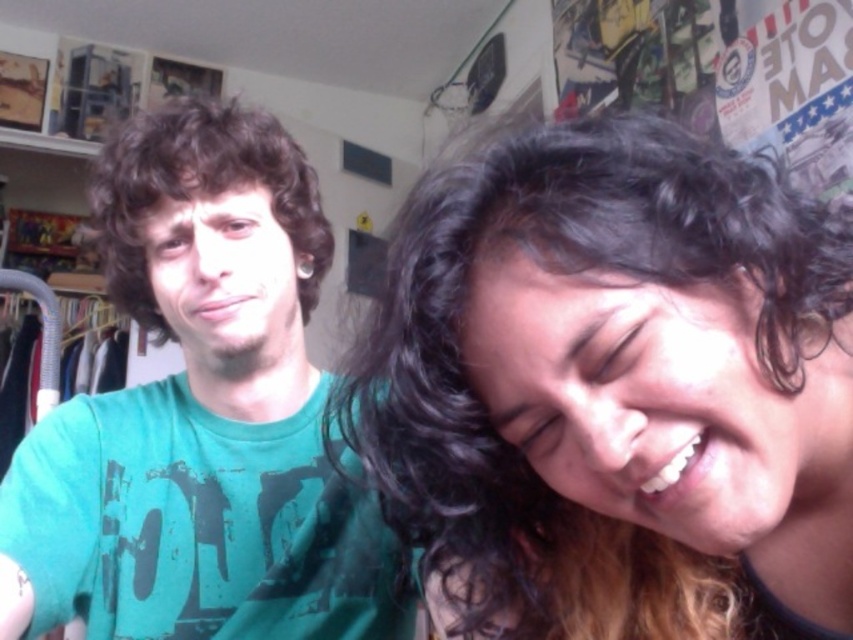
Between dark brown hair at upper right and dark curly hair at left, which one appears on the left side from the viewer's perspective?

dark curly hair at left is more to the left.

Can you confirm if dark brown hair at upper right is thinner than dark curly hair at left?

No, dark brown hair at upper right is not thinner than dark curly hair at left.

Is point (541, 236) in front of point (321, 256)?

Yes, it is in front of point (321, 256).

Find the location of a particular element. dark brown hair at upper right is located at coordinates (614, 388).

Consider the image. Between green matte t-shirt at left and dark curly hair at left, which one has less height?

Standing shorter between the two is dark curly hair at left.

Is point (279, 316) positioned in front of point (115, 230)?

No.

Locate an element on the screen. green matte t-shirt at left is located at coordinates (199, 413).

Who is more forward, (815, 307) or (315, 544)?

Positioned in front is point (815, 307).

Can you confirm if dark brown hair at upper right is thinner than green matte t-shirt at left?

Yes, dark brown hair at upper right is thinner than green matte t-shirt at left.

Which is in front, point (695, 168) or point (9, 588)?

Positioned in front is point (695, 168).

Locate an element on the screen. The width and height of the screenshot is (853, 640). dark brown hair at upper right is located at coordinates (614, 388).